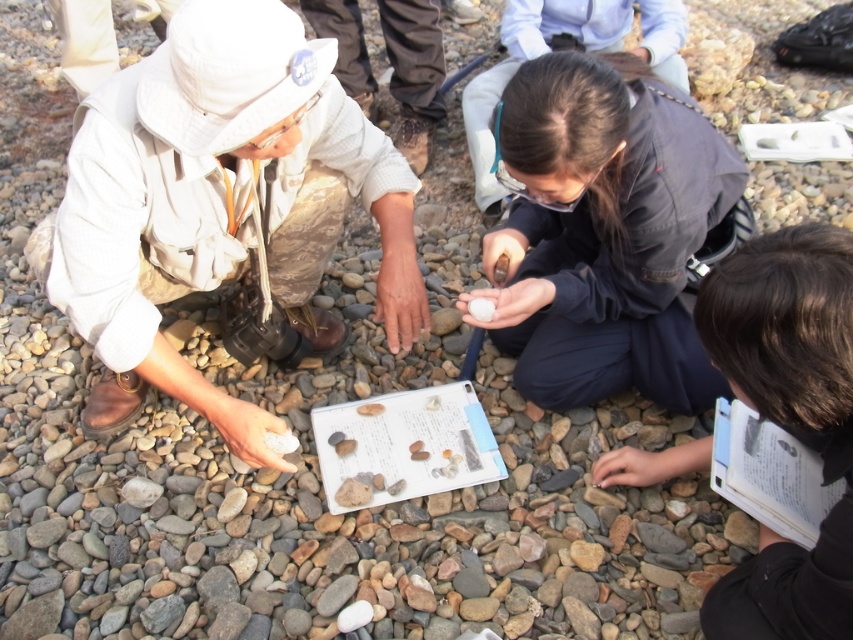
You are a photographer standing at the camera position. You want to take a photo of the matte beige hat at upper left. To ensure the hat is in focus, you need to adjust the camera lens to the correct distance. What distance should you set the focus to?

The distance between the matte beige hat at upper left and the camera is 1.20 meters, so you should set the focus distance to 1.20 meters to capture the matte beige hat at upper left clearly.

You are standing at the point marked as point (x=606, y=232) in the image. What color fabric do you see directly in front of you?

The point (x=606, y=232) marks dark blue fabric at center, so you would see dark blue fabric directly in front of you.

You are standing at the position of the person holding the rock and looking towards the group. Which of the two points, point (306,60) or point (514,276), is closer to you?

Point (306,60) is closer to you because it is in front of point (514,276).